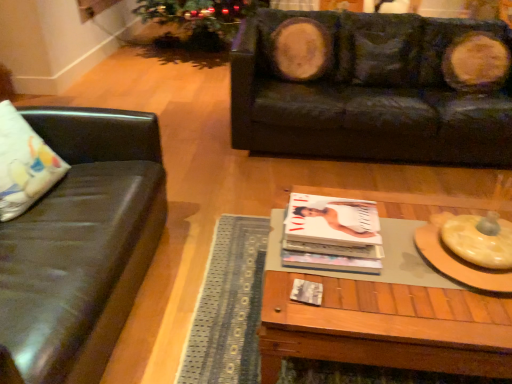
At what (x,y) coordinates should I click in order to perform the action: click on free location above woodenwoodencoffee table at center (from a real-world perspective). Please return your answer as a coordinate pair (x, y). The image size is (512, 384). Looking at the image, I should click on coord(405,263).